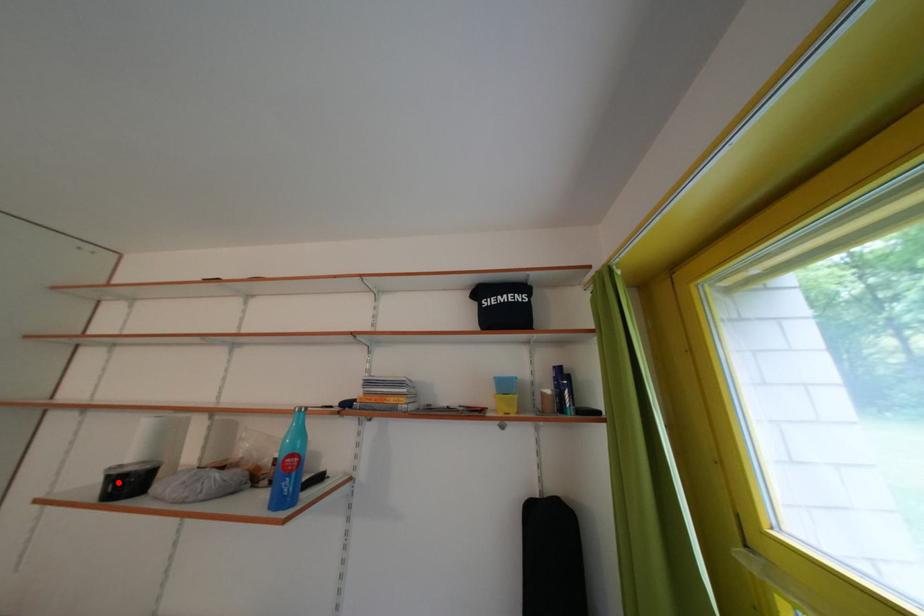
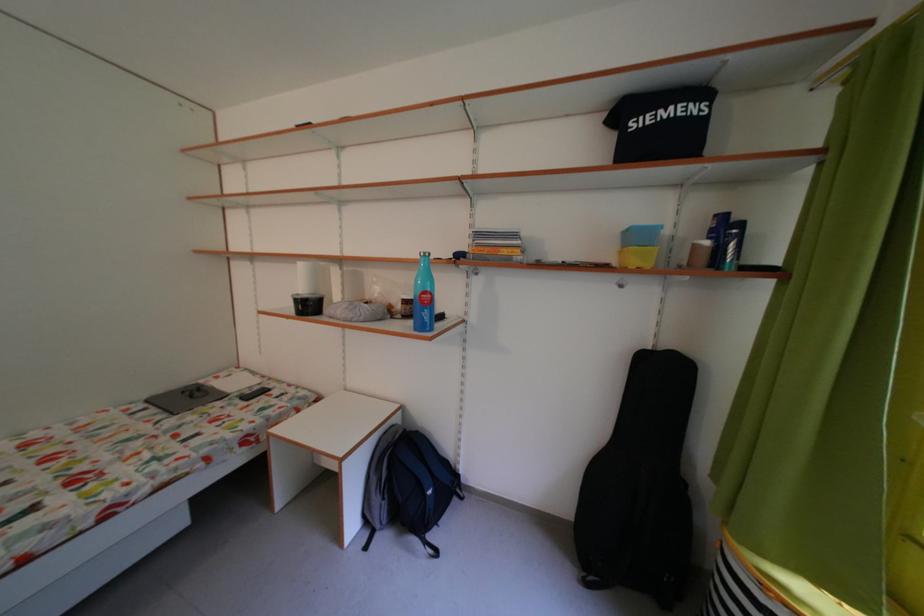
In the second image, find the point that corresponds to the highlighted location in the first image.

(306, 306)